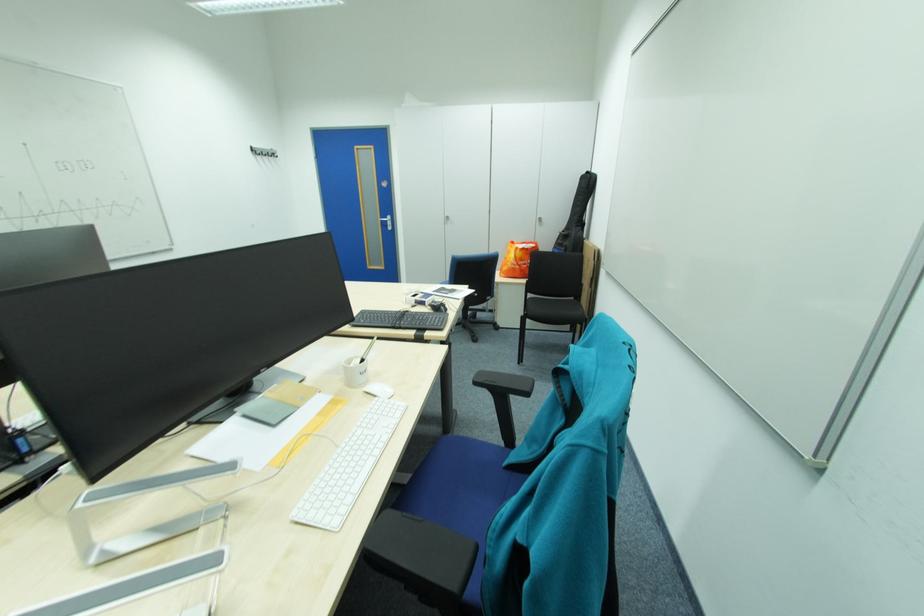
Locate an element on the screen. black wall hook is located at coordinates (263, 152).